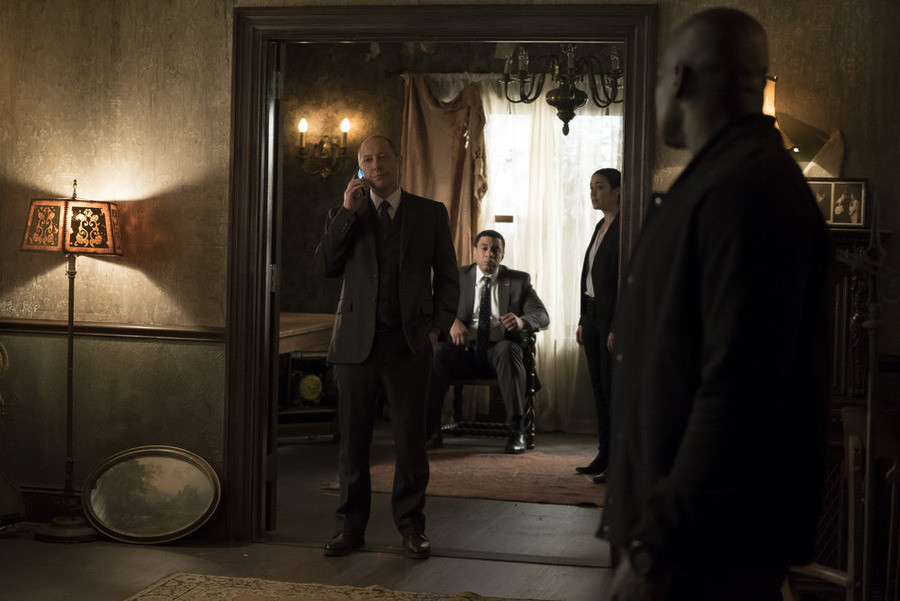
The width and height of the screenshot is (900, 601). Identify the location of pictures. (839, 202).